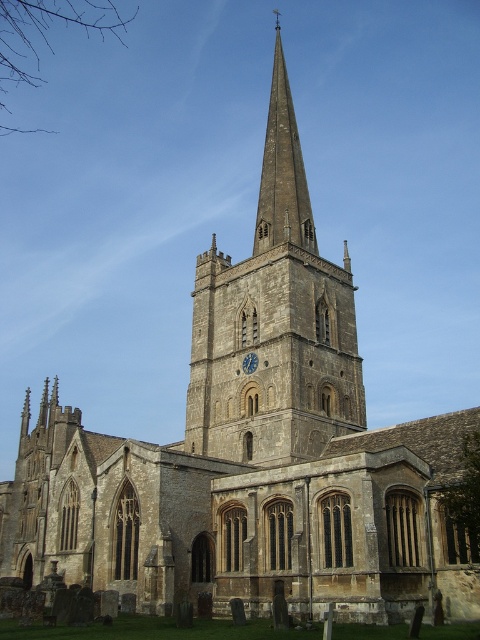
Question: Does stone steeple at center appear on the left side of blue painted wood clock at center?

Choices:
 (A) yes
 (B) no

Answer: (B)

Question: Which of the following is the farthest from the observer?

Choices:
 (A) (331, 300)
 (B) (243, 364)

Answer: (A)

Question: Which point is closer to the camera taking this photo?

Choices:
 (A) (298, 193)
 (B) (241, 368)

Answer: (B)

Question: Is stone steeple at center behind blue painted wood clock at center?

Choices:
 (A) no
 (B) yes

Answer: (A)

Question: Does stone steeple at center have a smaller size compared to blue painted wood clock at center?

Choices:
 (A) yes
 (B) no

Answer: (B)